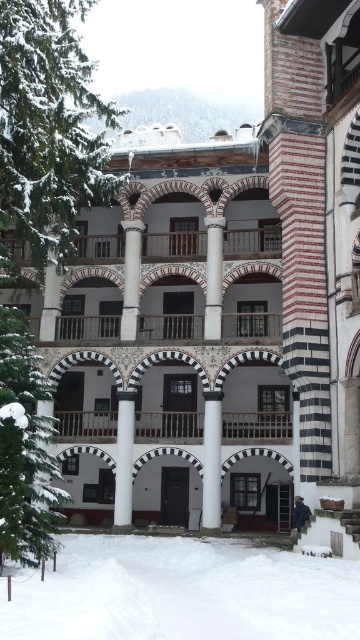
You are standing in front of the building and see a point marked at coordinates (x=213, y=276). Based on the scene description, what object is located at that point?

The point at coordinates (x=213, y=276) corresponds to the white stone column at center.

You are standing in front of the traditional building and want to determine the relative positions of two points marked on the structure. Which point, point (77, 621) or point (209, 246), is closer to you?

Point (77, 621) is closer to the viewer than point (209, 246).

Looking at this image, you are standing at the entrance of the historical building and looking towards the snowy landscape. There is a point marked at coordinates (181,593). Based on the scene description, what is the most likely substance located at this point?

The point at coordinates (181,593) corresponds to white powdery snow at lower center, so the substance is snow.